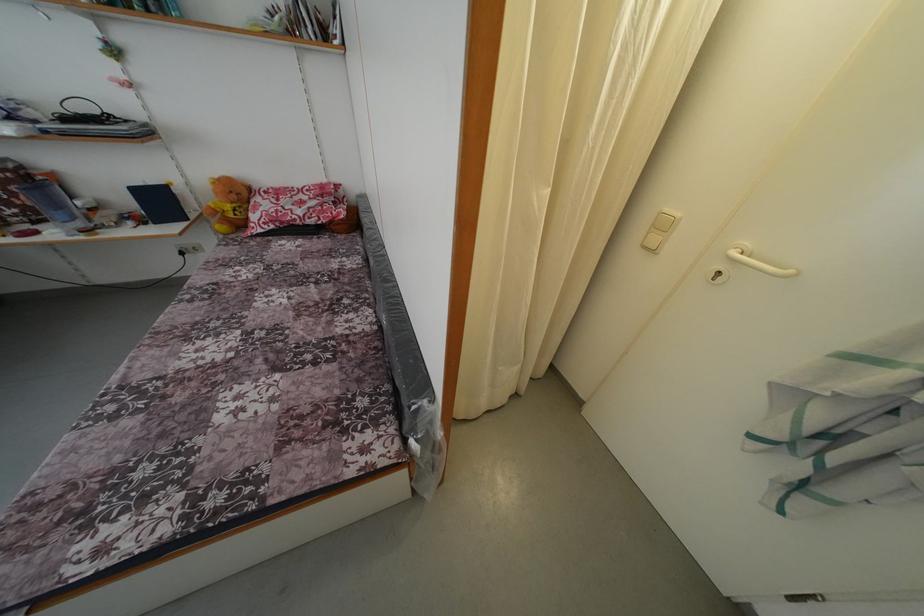
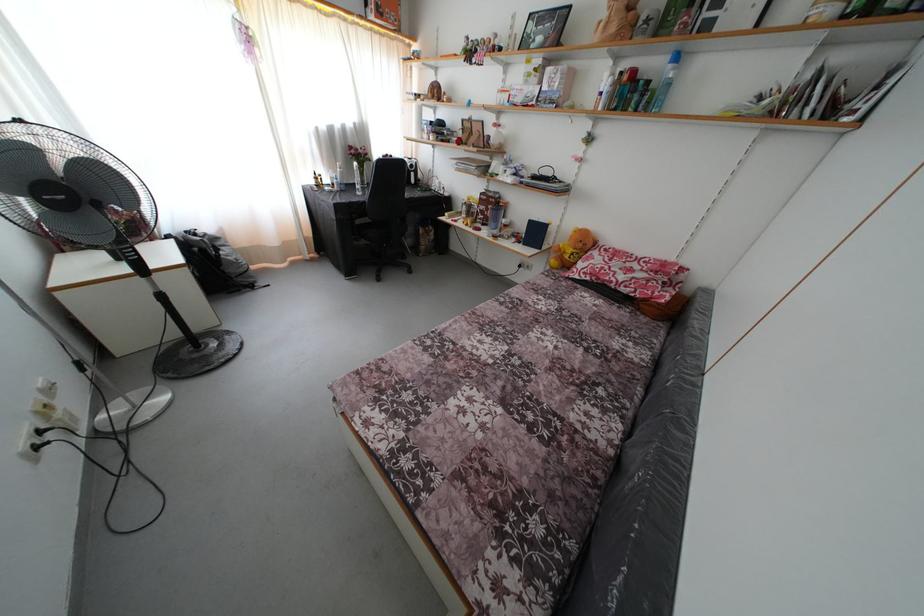
Find the pixel in the second image that matches point 367,256 in the first image.

(663, 353)